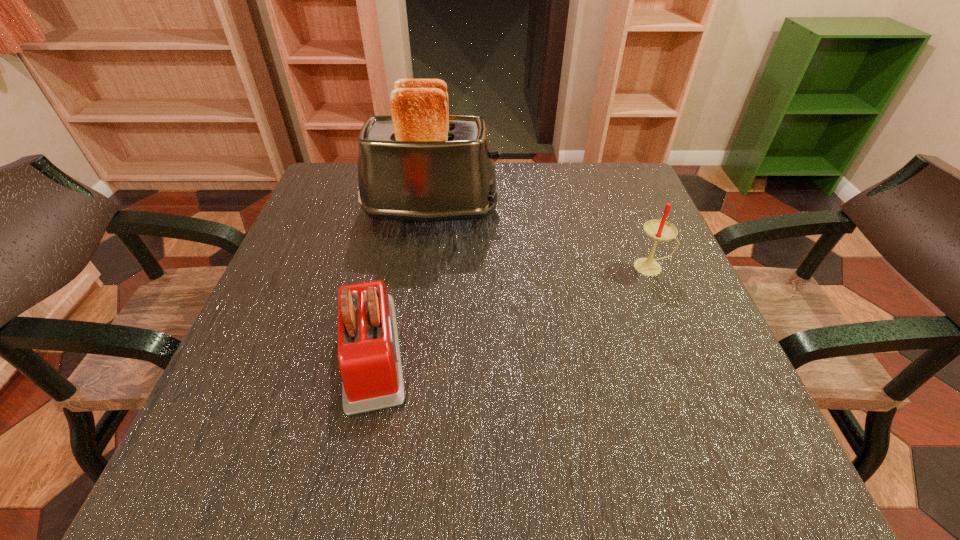
This screenshot has width=960, height=540. I want to click on the farther toaster, so click(421, 164).

The image size is (960, 540). What are the coordinates of `the taller toaster` in the screenshot? It's located at (421, 164).

I want to click on candle, so click(660, 230).

Image resolution: width=960 pixels, height=540 pixels. I want to click on the rightmost object, so click(x=660, y=230).

Locate an element on the screen. the shorter toaster is located at coordinates (369, 359).

The image size is (960, 540). I want to click on the nearest object, so click(x=369, y=359).

Where is `vacant space located 0.300m on the side of the farthest object with the control lever`? The image size is (960, 540). vacant space located 0.300m on the side of the farthest object with the control lever is located at coordinates (625, 211).

At what (x,y) coordinates should I click in order to perform the action: click on vacant point located 0.280m on the left of the rightmost object. Please return your answer as a coordinate pair (x, y). The height and width of the screenshot is (540, 960). Looking at the image, I should click on (497, 267).

Identify the location of vacant space located 0.370m on the back of the nearer toaster. This screenshot has width=960, height=540. (406, 191).

At what (x,y) coordinates should I click in order to perform the action: click on object located in the far edge section of the desktop. Please return your answer as a coordinate pair (x, y). Image resolution: width=960 pixels, height=540 pixels. Looking at the image, I should click on (421, 164).